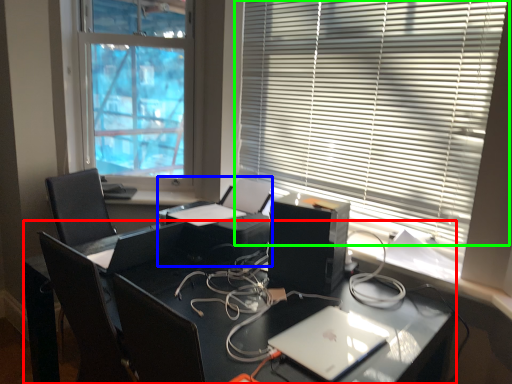
Question: Estimate the real-world distances between objects in this image. Which object is farther from desk (highlighted by a red box), printer (highlighted by a blue box) or window blind (highlighted by a green box)?

Choices:
 (A) printer
 (B) window blind

Answer: (B)